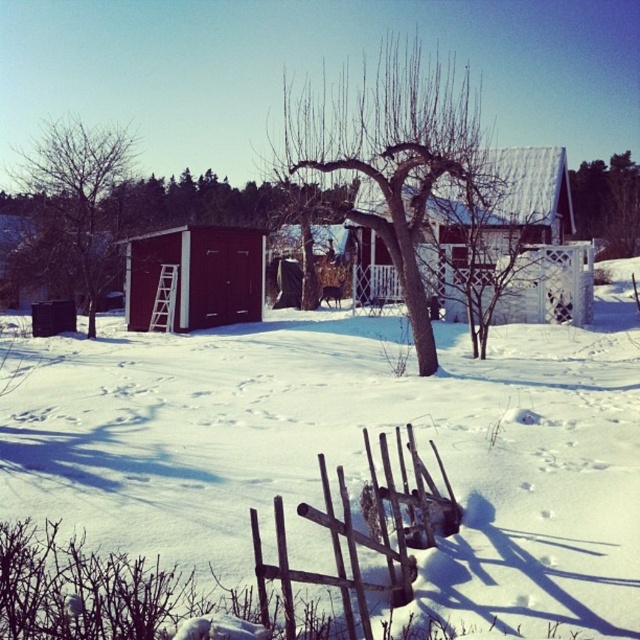
Does white wooden barn at center come in front of smooth brown tree trunk at left?

Yes, it is.

Can you confirm if white wooden barn at center is positioned to the left of smooth brown tree trunk at left?

Incorrect, white wooden barn at center is not on the left side of smooth brown tree trunk at left.

Does point (547, 193) come closer to viewer compared to point (36, 253)?

No, it is behind (36, 253).

The image size is (640, 640). In order to click on white wooden barn at center in this screenshot , I will do `click(525, 198)`.

Can you confirm if white powdery snow at center is taller than dark brown wood shed at center?

In fact, white powdery snow at center may be shorter than dark brown wood shed at center.

Is the position of white powdery snow at center less distant than that of dark brown wood shed at center?

Yes, white powdery snow at center is in front of dark brown wood shed at center.

The height and width of the screenshot is (640, 640). In order to click on white powdery snow at center in this screenshot , I will do `click(353, 451)`.

This screenshot has width=640, height=640. Find the location of `white powdery snow at center`. white powdery snow at center is located at coordinates (353, 451).

Is white powdery snow at center in front of green leafy tree at upper right?

Yes, white powdery snow at center is closer to the viewer.

Who is shorter, white powdery snow at center or green leafy tree at upper right?

white powdery snow at center is shorter.

Is point (154, 458) farther from camera compared to point (630, 177)?

No.

Find the location of a particular element. This screenshot has width=640, height=640. white powdery snow at center is located at coordinates (353, 451).